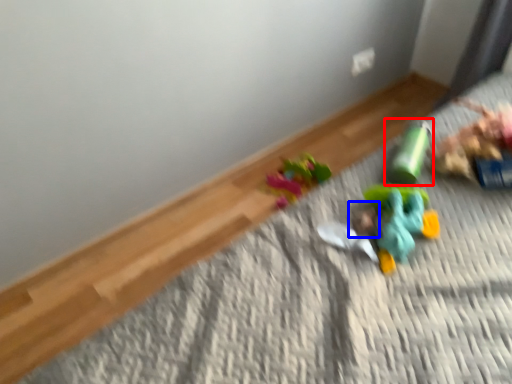
Question: Among these objects, which one is farthest to the camera, toy (highlighted by a red box) or head (highlighted by a blue box)?

Choices:
 (A) toy
 (B) head

Answer: (A)